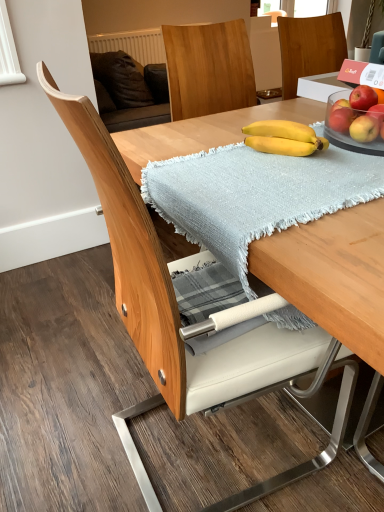
Find the location of a particular element. vacant space to the left of matte yellow apple at right, the fourth apple viewed from the top is located at coordinates (314, 142).